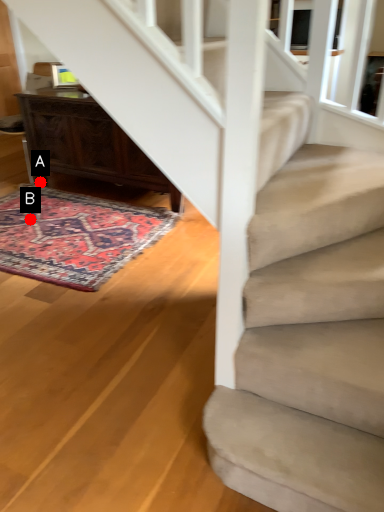
Question: Two points are circled on the image, labeled by A and B beside each circle. Which point appears farthest from the camera in this image?

Choices:
 (A) A is further
 (B) B is further

Answer: (A)